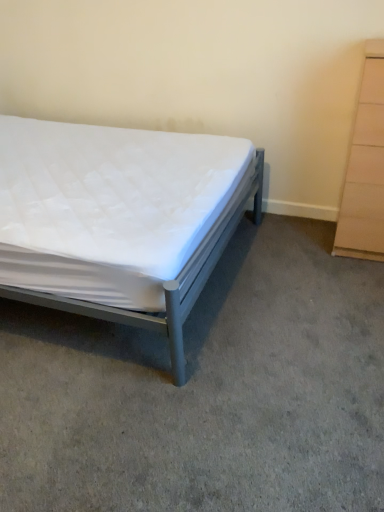
Question: Is beige wood chest of drawers at right wider than white quilted mattress at center?

Choices:
 (A) yes
 (B) no

Answer: (B)

Question: Considering the relative positions of beige wood chest of drawers at right and white quilted mattress at center in the image provided, is beige wood chest of drawers at right to the left of white quilted mattress at center from the viewer's perspective?

Choices:
 (A) no
 (B) yes

Answer: (A)

Question: Considering the relative sizes of beige wood chest of drawers at right and white quilted mattress at center in the image provided, is beige wood chest of drawers at right thinner than white quilted mattress at center?

Choices:
 (A) no
 (B) yes

Answer: (B)

Question: Can you confirm if beige wood chest of drawers at right is shorter than white quilted mattress at center?

Choices:
 (A) no
 (B) yes

Answer: (A)

Question: Considering the relative positions of beige wood chest of drawers at right and white quilted mattress at center in the image provided, is beige wood chest of drawers at right to the right of white quilted mattress at center from the viewer's perspective?

Choices:
 (A) no
 (B) yes

Answer: (B)

Question: Looking at their shapes, would you say metallic gray bed at left is wider or thinner than beige wood chest of drawers at right?

Choices:
 (A) thin
 (B) wide

Answer: (B)

Question: Would you say metallic gray bed at left is to the left or to the right of beige wood chest of drawers at right in the picture?

Choices:
 (A) right
 (B) left

Answer: (B)

Question: Looking at the image, does metallic gray bed at left seem bigger or smaller compared to beige wood chest of drawers at right?

Choices:
 (A) big
 (B) small

Answer: (A)

Question: From the image's perspective, is metallic gray bed at left above or below beige wood chest of drawers at right?

Choices:
 (A) below
 (B) above

Answer: (A)

Question: Looking at their shapes, would you say metallic gray bed at left is wider or thinner than white quilted mattress at center?

Choices:
 (A) wide
 (B) thin

Answer: (B)

Question: Is point (203, 148) closer or farther from the camera than point (317, 403)?

Choices:
 (A) closer
 (B) farther

Answer: (B)

Question: Which is correct: metallic gray bed at left is inside white quilted mattress at center, or outside of it?

Choices:
 (A) inside
 (B) outside

Answer: (B)

Question: Is metallic gray bed at left to the left or to the right of white quilted mattress at center in the image?

Choices:
 (A) right
 (B) left

Answer: (B)

Question: From their relative heights in the image, would you say white quilted mattress at center is taller or shorter than metallic gray bed at left?

Choices:
 (A) tall
 (B) short

Answer: (B)

Question: Looking at the image, does white quilted mattress at center seem bigger or smaller compared to metallic gray bed at left?

Choices:
 (A) small
 (B) big

Answer: (A)